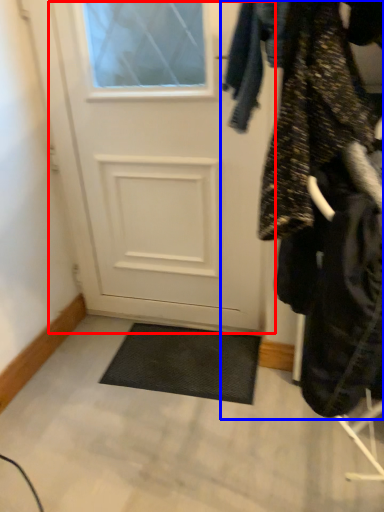
Question: Which point is further to the camera, door (highlighted by a red box) or closet (highlighted by a blue box)?

Choices:
 (A) door
 (B) closet

Answer: (A)